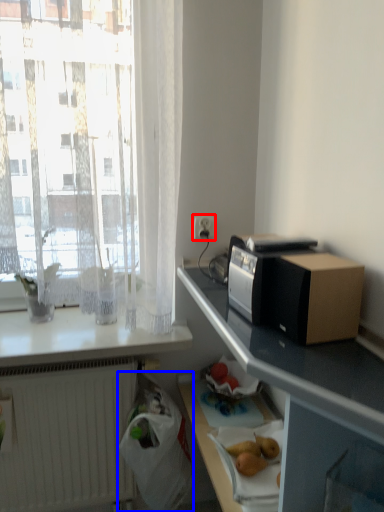
Question: Which point is further to the camera, electric outlet (highlighted by a red box) or shopping bag (highlighted by a blue box)?

Choices:
 (A) electric outlet
 (B) shopping bag

Answer: (A)